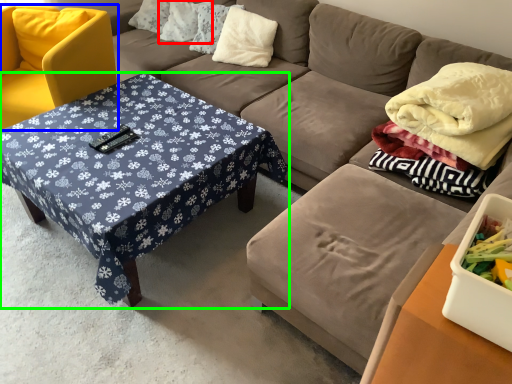
Question: Based on their relative distances, which object is farther from pillow (highlighted by a red box)? Choose from chair (highlighted by a blue box) and coffee table (highlighted by a green box).

Choices:
 (A) chair
 (B) coffee table

Answer: (B)